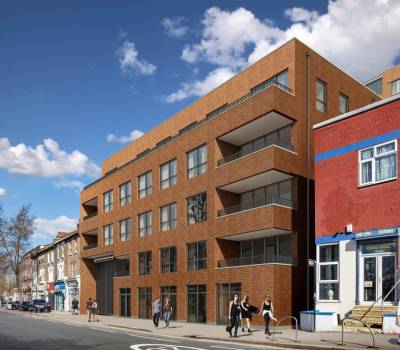
Where is `door`? The image size is (400, 350). door is located at coordinates point(388,276).